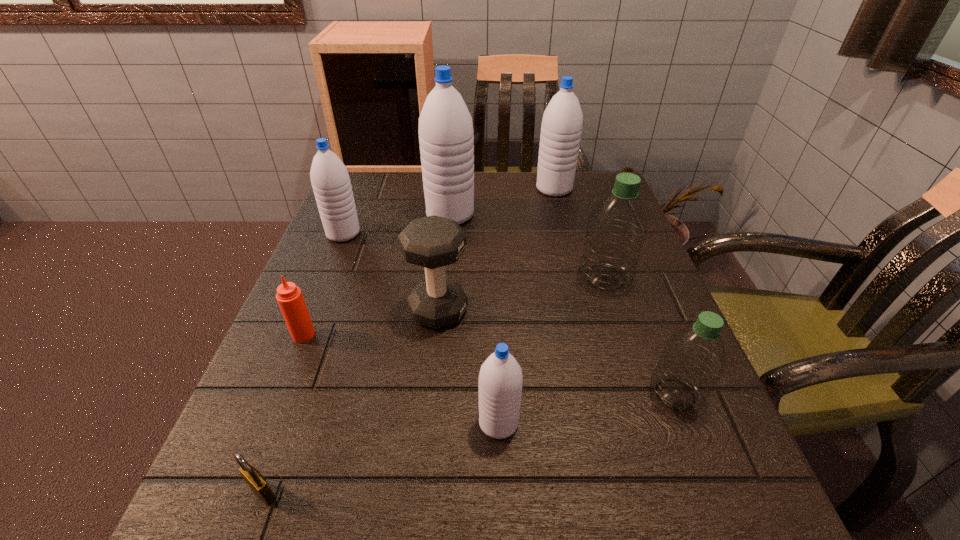
The height and width of the screenshot is (540, 960). Identify the location of the tallest object. pos(446,138).

Locate an element on the screen. Image resolution: width=960 pixels, height=540 pixels. the fifth water bottle from right to left is located at coordinates pyautogui.click(x=446, y=138).

Where is `the farthest water bottle`? The image size is (960, 540). the farthest water bottle is located at coordinates (562, 122).

The width and height of the screenshot is (960, 540). I want to click on the farthest blue water bottle, so click(x=562, y=122).

Identify the location of the second smallest blue water bottle. (331, 184).

You are a GUI agent. You are given a task and a screenshot of the screen. Output one action in this format:
    pyautogui.click(x=<x>, y=<y>)
    Task: Click on the leftmost blue water bottle
    
    Given the screenshot: What is the action you would take?
    pyautogui.click(x=331, y=184)

Where is `the farther green water bottle`? The image size is (960, 540). the farther green water bottle is located at coordinates (617, 228).

Where is `the fourth farthest water bottle`? The width and height of the screenshot is (960, 540). the fourth farthest water bottle is located at coordinates (617, 228).

In order to click on dumbbell in this screenshot , I will do click(x=433, y=242).

In order to click on the nearer green water bottle in this screenshot , I will do `click(692, 360)`.